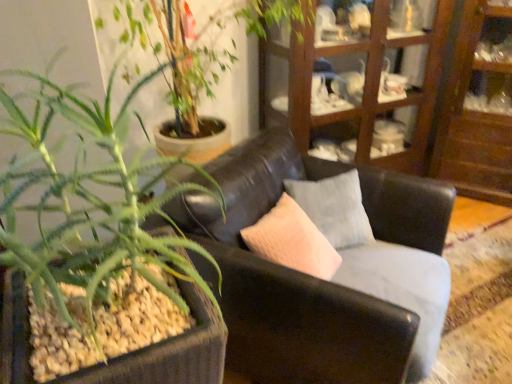
Question: Could wooden cabinet at upper right be considered to be inside wooden cabinet at upper right?

Choices:
 (A) yes
 (B) no

Answer: (B)

Question: Is wooden cabinet at upper right positioned behind wooden cabinet at upper right?

Choices:
 (A) yes
 (B) no

Answer: (A)

Question: Is there a large distance between wooden cabinet at upper right and wooden cabinet at upper right?

Choices:
 (A) no
 (B) yes

Answer: (A)

Question: Is wooden cabinet at upper right in contact with wooden cabinet at upper right?

Choices:
 (A) no
 (B) yes

Answer: (A)

Question: Is wooden cabinet at upper right smaller than wooden cabinet at upper right?

Choices:
 (A) no
 (B) yes

Answer: (B)

Question: Can you confirm if wooden cabinet at upper right is wider than wooden cabinet at upper right?

Choices:
 (A) yes
 (B) no

Answer: (B)

Question: Can you confirm if wooden cabinet at upper right is positioned to the left of black leather couch at center?

Choices:
 (A) yes
 (B) no

Answer: (B)

Question: Is wooden cabinet at upper right bigger than black leather couch at center?

Choices:
 (A) yes
 (B) no

Answer: (B)

Question: Is wooden cabinet at upper right in front of black leather couch at center?

Choices:
 (A) no
 (B) yes

Answer: (A)

Question: From the image's perspective, is wooden cabinet at upper right beneath black leather couch at center?

Choices:
 (A) yes
 (B) no

Answer: (B)

Question: Can you confirm if wooden cabinet at upper right is smaller than black leather couch at center?

Choices:
 (A) no
 (B) yes

Answer: (B)

Question: From the image's perspective, is wooden cabinet at upper right above black leather couch at center?

Choices:
 (A) yes
 (B) no

Answer: (A)

Question: From a real-world perspective, is wooden cabinet at upper right under wooden cabinet at upper right?

Choices:
 (A) no
 (B) yes

Answer: (A)